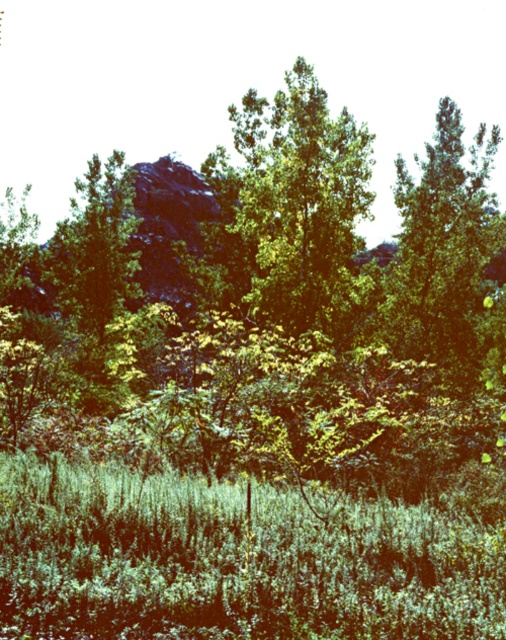
In the scene shown: You are standing at the lower center of the image. You want to place a small decorative rock exactly at the location of the green leafy grass at lower center. What coordinates should you use?

The coordinates for the green leafy grass at lower center are at point (x=233, y=561).